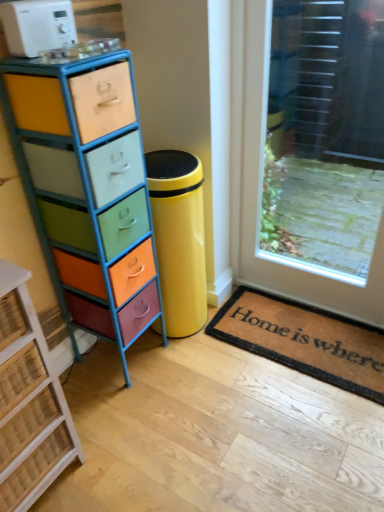
Where is `vacant space to the right of multicolored painted wood chest of drawers at left, which is the 1th chest of drawers from right to left`? This screenshot has width=384, height=512. vacant space to the right of multicolored painted wood chest of drawers at left, which is the 1th chest of drawers from right to left is located at coordinates (189, 369).